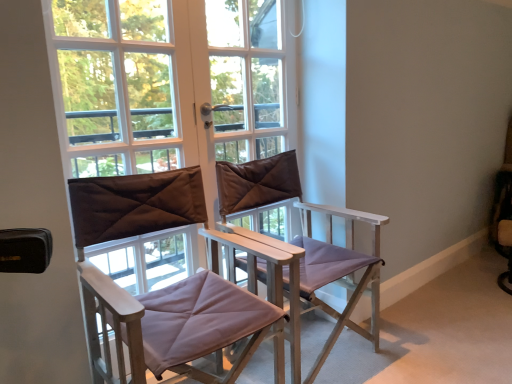
Question: Does transparent glass window at center have a greater height compared to matte brown director's chair at center, the second chair in the right-to-left sequence?

Choices:
 (A) yes
 (B) no

Answer: (A)

Question: Is transparent glass window at center positioned before matte brown director's chair at center, arranged as the 1th chair when viewed from the left?

Choices:
 (A) yes
 (B) no

Answer: (B)

Question: Does transparent glass window at center have a larger size compared to matte brown director's chair at center, the second chair in the right-to-left sequence?

Choices:
 (A) no
 (B) yes

Answer: (A)

Question: Is transparent glass window at center at the left side of matte brown director's chair at center, arranged as the 1th chair when viewed from the left?

Choices:
 (A) yes
 (B) no

Answer: (B)

Question: Considering the relative sizes of transparent glass window at center and matte brown director's chair at center, arranged as the 1th chair when viewed from the left, in the image provided, is transparent glass window at center thinner than matte brown director's chair at center, arranged as the 1th chair when viewed from the left,?

Choices:
 (A) no
 (B) yes

Answer: (B)

Question: From the image's perspective, is transparent glass window at center beneath matte brown director's chair at center, arranged as the 1th chair when viewed from the left?

Choices:
 (A) no
 (B) yes

Answer: (A)

Question: Is matte brown director's chair at center, the second chair in the right-to-left sequence, surrounded by purple fabric chair at center, which is the 2th chair in left-to-right order?

Choices:
 (A) no
 (B) yes

Answer: (A)

Question: Can you confirm if purple fabric chair at center, which is the 2th chair in left-to-right order, is positioned to the left of matte brown director's chair at center, the second chair in the right-to-left sequence?

Choices:
 (A) no
 (B) yes

Answer: (A)

Question: From a real-world perspective, is purple fabric chair at center, acting as the 1th chair starting from the right, positioned under matte brown director's chair at center, the second chair in the right-to-left sequence, based on gravity?

Choices:
 (A) yes
 (B) no

Answer: (A)

Question: From a real-world perspective, is purple fabric chair at center, which is the 2th chair in left-to-right order, over matte brown director's chair at center, the second chair in the right-to-left sequence?

Choices:
 (A) no
 (B) yes

Answer: (A)

Question: Is purple fabric chair at center, acting as the 1th chair starting from the right, oriented towards matte brown director's chair at center, arranged as the 1th chair when viewed from the left?

Choices:
 (A) yes
 (B) no

Answer: (B)

Question: Does purple fabric chair at center, which is the 2th chair in left-to-right order, lie in front of matte brown director's chair at center, arranged as the 1th chair when viewed from the left?

Choices:
 (A) no
 (B) yes

Answer: (A)

Question: Is purple fabric chair at center, which is the 2th chair in left-to-right order, behind transparent glass window at center?

Choices:
 (A) yes
 (B) no

Answer: (B)